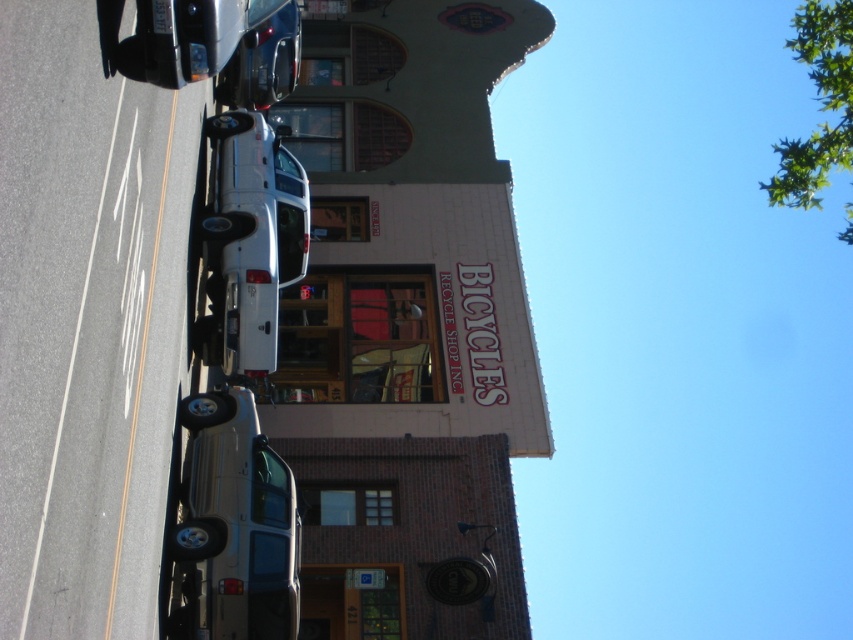
Between satin silver suv at lower left and metallic silver car at upper center, which one appears on the right side from the viewer's perspective?

Positioned to the right is satin silver suv at lower left.

The width and height of the screenshot is (853, 640). I want to click on satin silver suv at lower left, so click(x=233, y=528).

Which of these two, white matte truck at center or metallic silver car at upper center, stands taller?

With more height is white matte truck at center.

Between point (216, 257) and point (299, 12), which one is positioned behind?

The point (299, 12) is behind.

I want to click on white matte truck at center, so click(x=248, y=243).

Identify the location of white matte truck at center. The image size is (853, 640). (248, 243).

Is point (170, 612) closer to camera compared to point (209, 260)?

Yes.

I want to click on satin silver suv at lower left, so (233, 528).